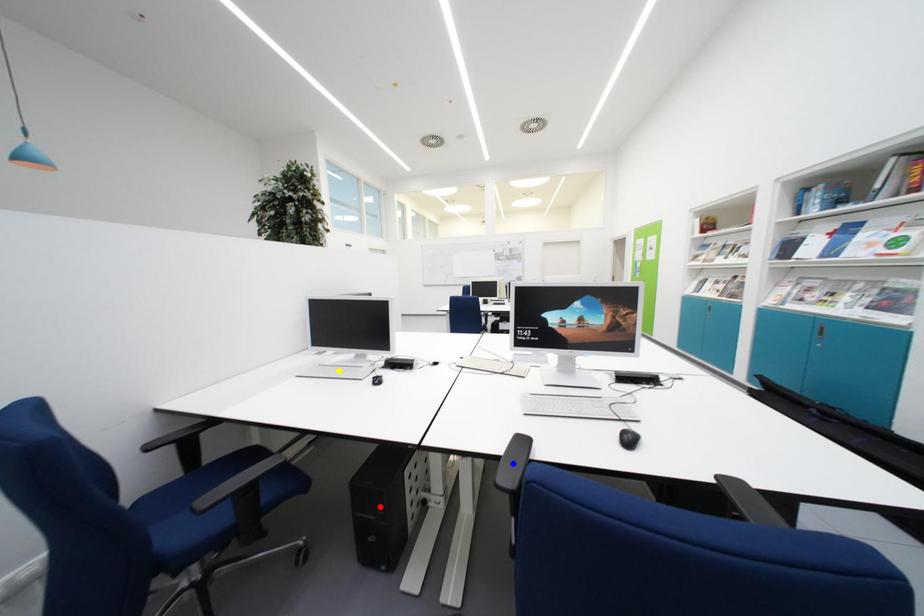
Based on the photo, order these from nearest to farthest:
blue point | yellow point | red point

blue point, red point, yellow point